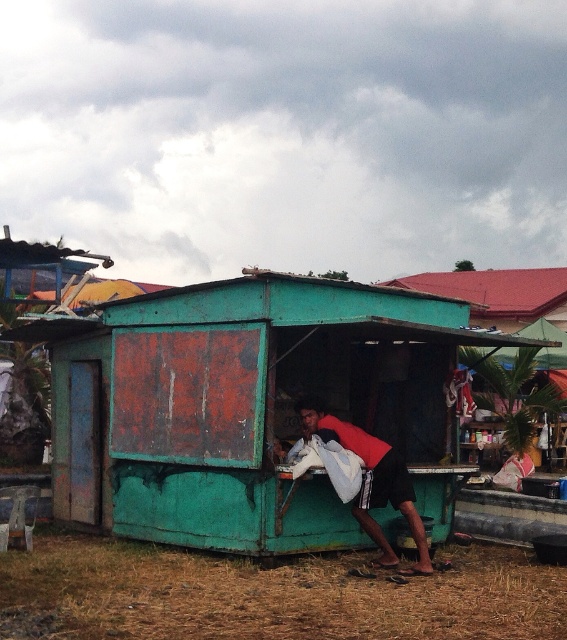
Who is lower down, rusty metal shack at center or orange fabric shirt at center?

orange fabric shirt at center is below.

Is point (382, 406) positioned after point (374, 451)?

Yes, point (382, 406) is behind point (374, 451).

Locate an element on the screen. This screenshot has height=640, width=567. rusty metal shack at center is located at coordinates (247, 406).